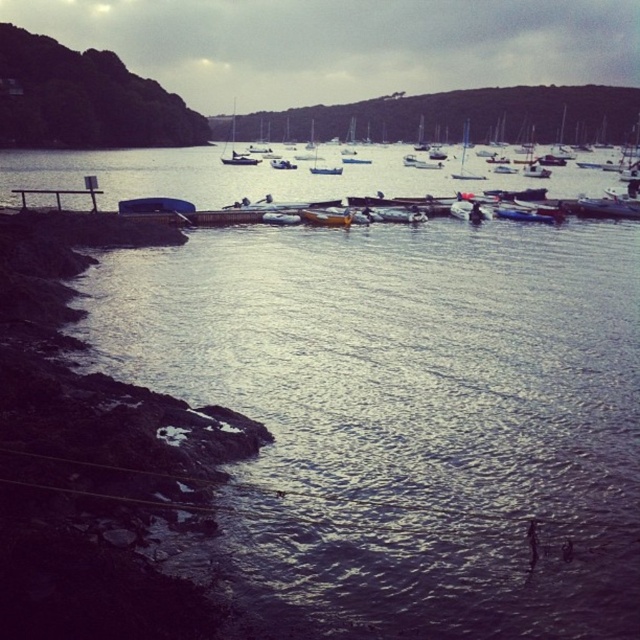
You are standing at the center of the image. Which direction should you walk to reach the wooden dock at left?

You should walk to the left to reach the wooden dock at left since it is located at point (58, 195) which is on the left side of the image.

You are standing at the point marked by the coordinate point at left, which is point (58, 195). You want to walk to the wooden dock at left. Is the wooden dock at left in your immediate vicinity?

The wooden dock at left is represented by point (58, 195), so yes, the wooden dock at left is in your immediate vicinity since you are already at its location.

You are standing on the wooden dock at left and want to board the white sailboat at center. Which direction should you move towards relative to the dock?

The wooden dock at left is positioned on the right side of the white sailboat at center, so you should move towards the left side of the dock to reach the white sailboat at center.